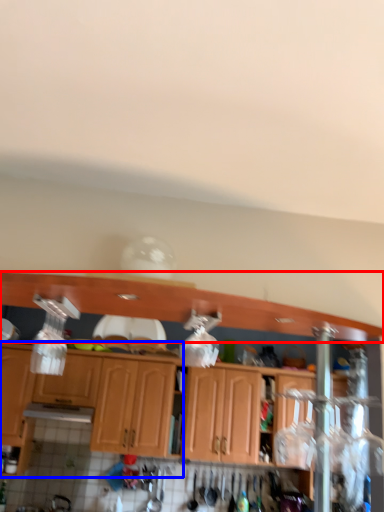
Question: Which object is further to the camera taking this photo, cabinetry (highlighted by a red box) or cabinetry (highlighted by a blue box)?

Choices:
 (A) cabinetry
 (B) cabinetry

Answer: (B)